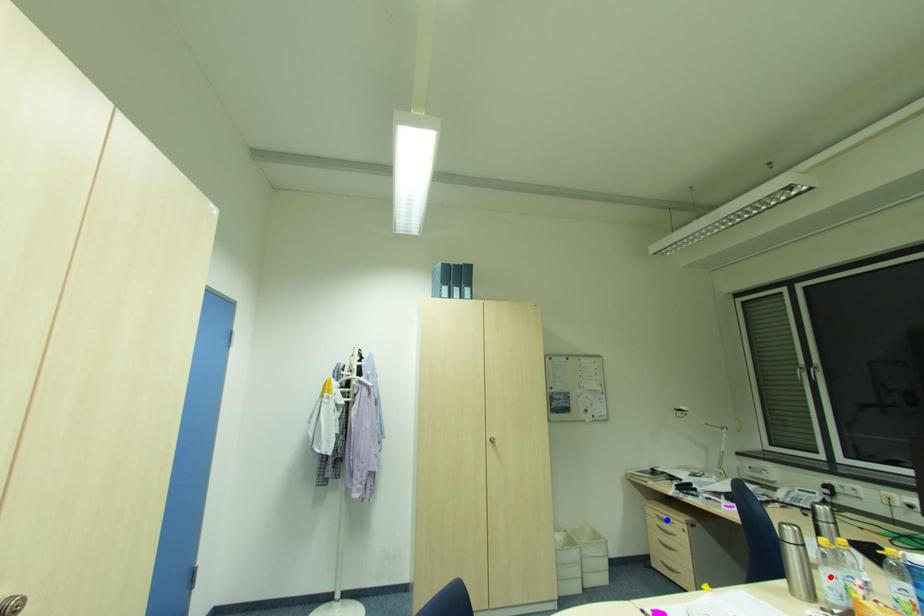
Question: In the image, two points are highlighted. Which point is nearer to the camera? Reply with the corresponding letter.

Choices:
 (A) blue point
 (B) red point

Answer: (B)